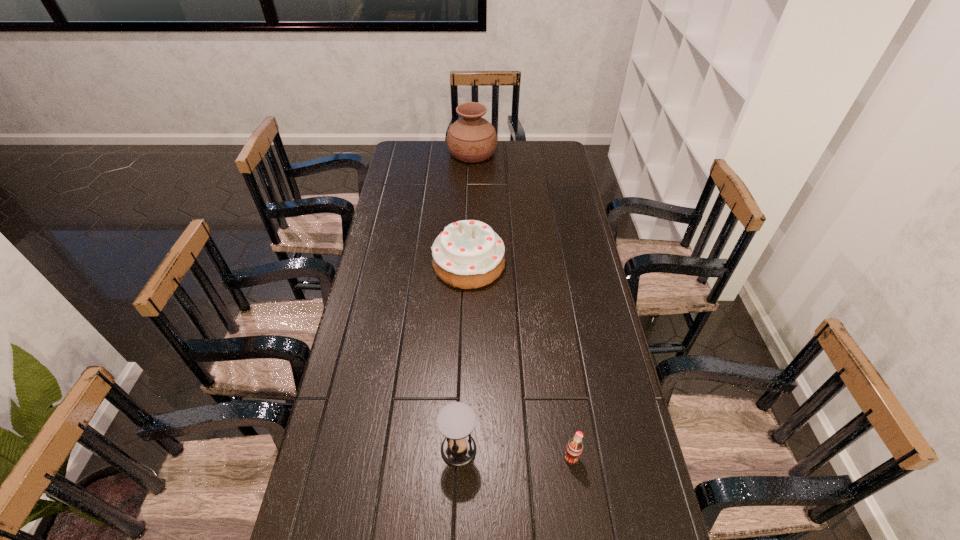
Locate an element on the screen. The width and height of the screenshot is (960, 540). object located in the far edge section of the desktop is located at coordinates (471, 139).

At what (x,y) coordinates should I click in order to perform the action: click on object located in the right edge section of the desktop. Please return your answer as a coordinate pair (x, y). Image resolution: width=960 pixels, height=540 pixels. Looking at the image, I should click on (574, 448).

Where is `vacant space at the far edge of the desktop`? This screenshot has width=960, height=540. vacant space at the far edge of the desktop is located at coordinates (470, 166).

Locate an element on the screen. This screenshot has width=960, height=540. vacant region at the left edge is located at coordinates (395, 228).

I want to click on free space at the right edge, so click(599, 487).

Image resolution: width=960 pixels, height=540 pixels. In the image, there is a desktop. In order to click on vacant space at the far left corner in this screenshot , I will do `click(411, 143)`.

At what (x,y) coordinates should I click in order to perform the action: click on unoccupied area between the rightmost object and the tallest object. Please return your answer as a coordinate pair (x, y). Looking at the image, I should click on (521, 305).

This screenshot has height=540, width=960. What are the coordinates of `free space between the farthest object and the shortest object` in the screenshot? It's located at (521, 305).

The height and width of the screenshot is (540, 960). I want to click on empty location between the cake and the soda, so click(519, 361).

Find the location of `free area in between the hourglass and the tallest object`. free area in between the hourglass and the tallest object is located at coordinates (466, 301).